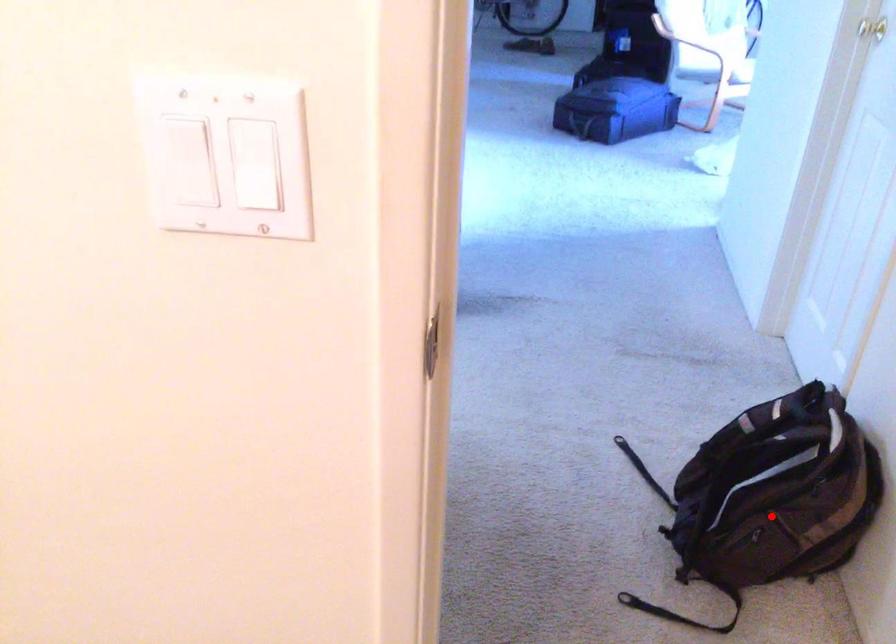
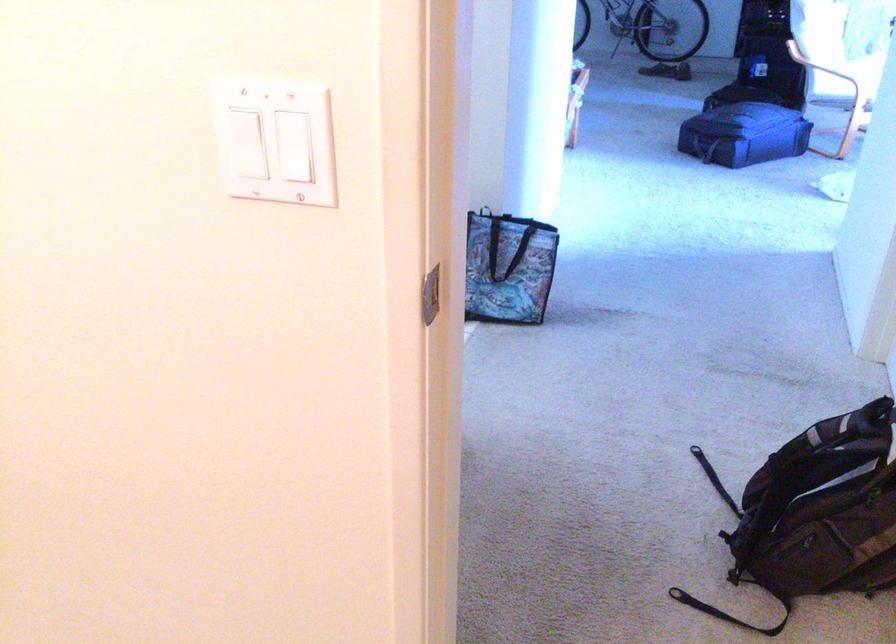
Locate, in the second image, the point that corresponds to the highlighted location in the first image.

(826, 516)